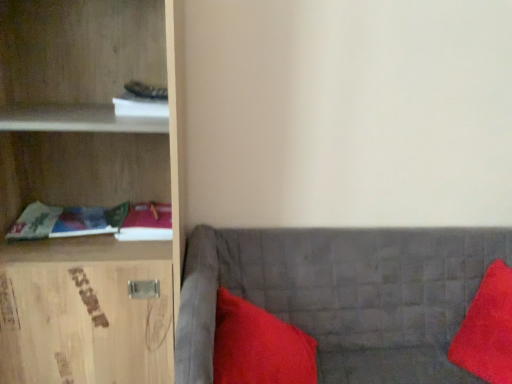
Find the location of a particular element. satin red pillow at lower right, which is the 2th pillow from right to left is located at coordinates (259, 346).

I want to click on matte fabric book at left, the first book in the bottom-to-top sequence, so [x=94, y=222].

What do you see at coordinates (147, 223) in the screenshot? I see `matte red book at left, the 2th book from the top` at bounding box center [147, 223].

You are a GUI agent. You are given a task and a screenshot of the screen. Output one action in this format:
    pyautogui.click(x=<x>, y=<y>)
    Task: Click on the white paper at upper left, which is the 1th book in top-to-bottom order
    This screenshot has width=512, height=384.
    Given the screenshot: What is the action you would take?
    pyautogui.click(x=140, y=106)

The width and height of the screenshot is (512, 384). Find the location of `satin red pillow at lower right, acting as the first pillow starting from the left`. satin red pillow at lower right, acting as the first pillow starting from the left is located at coordinates (259, 346).

Is matte fabric book at left, arranged as the 3th book when viewed from the top, in front of or behind satin red pillow at lower right, which is the 2th pillow from right to left, in the image?

Visually, matte fabric book at left, arranged as the 3th book when viewed from the top, is located behind satin red pillow at lower right, which is the 2th pillow from right to left.

Does matte fabric book at left, arranged as the 3th book when viewed from the top, contain satin red pillow at lower right, acting as the first pillow starting from the left?

No, satin red pillow at lower right, acting as the first pillow starting from the left, is not surrounded by matte fabric book at left, arranged as the 3th book when viewed from the top.

How different are the orientations of matte fabric book at left, the first book in the bottom-to-top sequence, and satin red pillow at lower right, acting as the first pillow starting from the left, in degrees?

0.6 degrees.

From the image's perspective, which is below, matte fabric book at left, arranged as the 3th book when viewed from the top, or satin red pillow at lower right, which is the 2th pillow from right to left?

From the image's view, satin red pillow at lower right, which is the 2th pillow from right to left, is below.

Does matte red book at left, the 2th book from the top, have a lesser width compared to velvet red pillow at right, the second pillow viewed from the left?

Correct, the width of matte red book at left, the 2th book from the top, is less than that of velvet red pillow at right, the second pillow viewed from the left.

From the image's perspective, is matte red book at left, the 2th book from the top, located beneath velvet red pillow at right, placed as the 1th pillow when sorted from right to left?

No.

Is matte red book at left, the 2th book from the top, closer to camera compared to velvet red pillow at right, placed as the 1th pillow when sorted from right to left?

No.

Which is in front, matte red book at left, the 2th book from the top, or white paper at upper left, positioned as the third book in bottom-to-top order?

white paper at upper left, positioned as the third book in bottom-to-top order, is in front.

Is matte red book at left, the 2th book from the top, smaller than white paper at upper left, positioned as the third book in bottom-to-top order?

No, matte red book at left, the 2th book from the top, is not smaller than white paper at upper left, positioned as the third book in bottom-to-top order.

In the scene shown: Do you think matte red book at left, the 2th book when ordered from bottom to top, is within white paper at upper left, positioned as the third book in bottom-to-top order, or outside of it?

matte red book at left, the 2th book when ordered from bottom to top, lies outside white paper at upper left, positioned as the third book in bottom-to-top order.

How many degrees apart are the facing directions of satin red pillow at lower right, acting as the first pillow starting from the left, and velvet grey couch at lower right?

0.000186 degrees.

Considering the relative sizes of satin red pillow at lower right, which is the 2th pillow from right to left, and velvet grey couch at lower right in the image provided, is satin red pillow at lower right, which is the 2th pillow from right to left, bigger than velvet grey couch at lower right?

No.

Based on the photo, from a real-world perspective, between satin red pillow at lower right, which is the 2th pillow from right to left, and velvet grey couch at lower right, who is vertically lower?

From a 3D spatial view, velvet grey couch at lower right is below.

The width and height of the screenshot is (512, 384). Find the location of `pillow on the left of velvet grey couch at lower right`. pillow on the left of velvet grey couch at lower right is located at coordinates (259, 346).

Which object is closer to the camera taking this photo, white paper at upper left, which is the 1th book in top-to-bottom order, or velvet grey couch at lower right?

velvet grey couch at lower right is in front.

From a real-world perspective, is white paper at upper left, which is the 1th book in top-to-bottom order, located beneath velvet grey couch at lower right?

Actually, white paper at upper left, which is the 1th book in top-to-bottom order, is physically above velvet grey couch at lower right in the real world.

From the image's perspective, is white paper at upper left, positioned as the third book in bottom-to-top order, located above or below velvet grey couch at lower right?

white paper at upper left, positioned as the third book in bottom-to-top order, is above velvet grey couch at lower right.

Which point is more forward, (125, 104) or (392, 339)?

The point (125, 104) is closer to the camera.

Is the depth of velvet red pillow at right, the second pillow viewed from the left, less than that of velvet grey couch at lower right?

That is False.

Can we say velvet red pillow at right, placed as the 1th pillow when sorted from right to left, lies outside velvet grey couch at lower right?

No, velvet red pillow at right, placed as the 1th pillow when sorted from right to left, is inside or overlapping with velvet grey couch at lower right.

Is velvet red pillow at right, the second pillow viewed from the left, facing towards velvet grey couch at lower right?

Yes, velvet red pillow at right, the second pillow viewed from the left, is turned towards velvet grey couch at lower right.

Which object is thinner, velvet red pillow at right, the second pillow viewed from the left, or velvet grey couch at lower right?

With smaller width is velvet red pillow at right, the second pillow viewed from the left.

Is white paper at upper left, which is the 1th book in top-to-bottom order, in front of matte fabric book at left, the first book in the bottom-to-top sequence?

Yes, white paper at upper left, which is the 1th book in top-to-bottom order, is closer to the viewer.

Visually, is white paper at upper left, positioned as the third book in bottom-to-top order, positioned to the left or to the right of matte fabric book at left, the first book in the bottom-to-top sequence?

From the image, it's evident that white paper at upper left, positioned as the third book in bottom-to-top order, is to the right of matte fabric book at left, the first book in the bottom-to-top sequence.

From the image's perspective, which one is positioned lower, white paper at upper left, which is the 1th book in top-to-bottom order, or matte fabric book at left, arranged as the 3th book when viewed from the top?

From the image's view, matte fabric book at left, arranged as the 3th book when viewed from the top, is below.

Based on the photo, from a real-world perspective, is white paper at upper left, positioned as the third book in bottom-to-top order, physically above matte fabric book at left, the first book in the bottom-to-top sequence?

Indeed, from a real-world perspective, white paper at upper left, positioned as the third book in bottom-to-top order, stands above matte fabric book at left, the first book in the bottom-to-top sequence.

The width and height of the screenshot is (512, 384). There is a matte fabric book at left, the first book in the bottom-to-top sequence. Find the location of `the 2nd pillow below it (from the image's perspective)`. the 2nd pillow below it (from the image's perspective) is located at coordinates (259, 346).

Where is `the 3rd book behind the velvet red pillow at right, placed as the 1th pillow when sorted from right to left`? the 3rd book behind the velvet red pillow at right, placed as the 1th pillow when sorted from right to left is located at coordinates (147, 223).

Based on their spatial positions, is velvet grey couch at lower right or light wood cabinet at left further from matte fabric book at left, arranged as the 3th book when viewed from the top?

velvet grey couch at lower right.

Based on their spatial positions, is white paper at upper left, positioned as the third book in bottom-to-top order, or matte fabric book at left, arranged as the 3th book when viewed from the top, closer to light wood cabinet at left?

Based on the image, matte fabric book at left, arranged as the 3th book when viewed from the top, appears to be nearer to light wood cabinet at left.

Considering their positions, is matte fabric book at left, arranged as the 3th book when viewed from the top, positioned further to velvet grey couch at lower right than satin red pillow at lower right, which is the 2th pillow from right to left?

The object further to velvet grey couch at lower right is matte fabric book at left, arranged as the 3th book when viewed from the top.

Which object lies further to the anchor point satin red pillow at lower right, acting as the first pillow starting from the left, light wood cabinet at left or matte fabric book at left, arranged as the 3th book when viewed from the top?

light wood cabinet at left.

Which object lies nearer to the anchor point velvet grey couch at lower right, matte red book at left, the 2th book when ordered from bottom to top, or light wood cabinet at left?

light wood cabinet at left is closer to velvet grey couch at lower right.

Based on their spatial positions, is velvet red pillow at right, the second pillow viewed from the left, or satin red pillow at lower right, acting as the first pillow starting from the left, further from light wood cabinet at left?

Based on the image, velvet red pillow at right, the second pillow viewed from the left, appears to be further to light wood cabinet at left.

Based on their spatial positions, is satin red pillow at lower right, acting as the first pillow starting from the left, or matte fabric book at left, the first book in the bottom-to-top sequence, further from velvet red pillow at right, the second pillow viewed from the left?

matte fabric book at left, the first book in the bottom-to-top sequence.

Which object lies further to the anchor point satin red pillow at lower right, acting as the first pillow starting from the left, matte red book at left, the 2th book from the top, or white paper at upper left, positioned as the third book in bottom-to-top order?

white paper at upper left, positioned as the third book in bottom-to-top order, is positioned further to the anchor satin red pillow at lower right, acting as the first pillow starting from the left.

Where is `studio couch located between light wood cabinet at left and velvet red pillow at right, the second pillow viewed from the left, in the left-right direction`? The height and width of the screenshot is (384, 512). studio couch located between light wood cabinet at left and velvet red pillow at right, the second pillow viewed from the left, in the left-right direction is located at coordinates (342, 295).

The width and height of the screenshot is (512, 384). Identify the location of book between white paper at upper left, which is the 1th book in top-to-bottom order, and velvet grey couch at lower right, in the horizontal direction. (x=147, y=223).

Find the location of a particular element. pillow between matte fabric book at left, arranged as the 3th book when viewed from the top, and velvet grey couch at lower right is located at coordinates pyautogui.click(x=259, y=346).

Locate an element on the screen. This screenshot has width=512, height=384. studio couch situated between matte red book at left, the 2th book from the top, and velvet red pillow at right, the second pillow viewed from the left, from left to right is located at coordinates (342, 295).